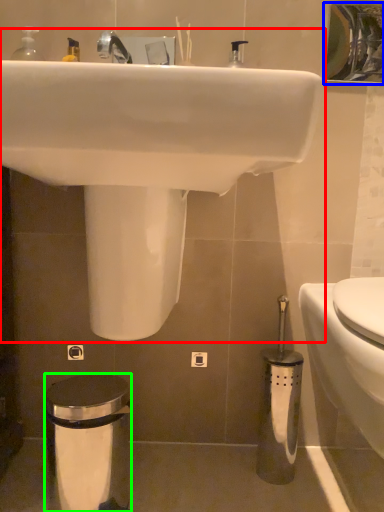
Question: Based on their relative distances, which object is nearer to sink (highlighted by a red box)? Choose from mirror (highlighted by a blue box) and trash bin/can (highlighted by a green box).

Choices:
 (A) mirror
 (B) trash bin/can

Answer: (B)